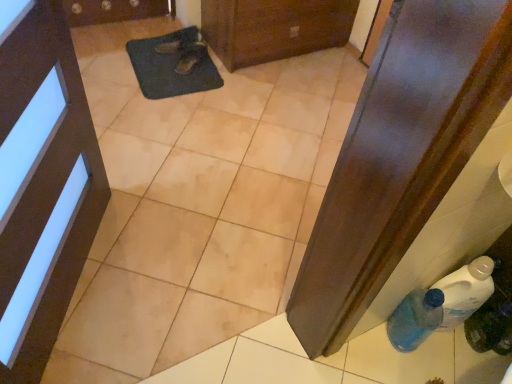
What are the coordinates of `free location to the left of blue translucent bottle at lower right, positioned as the second bottle in left-to-right order` in the screenshot? It's located at (431, 359).